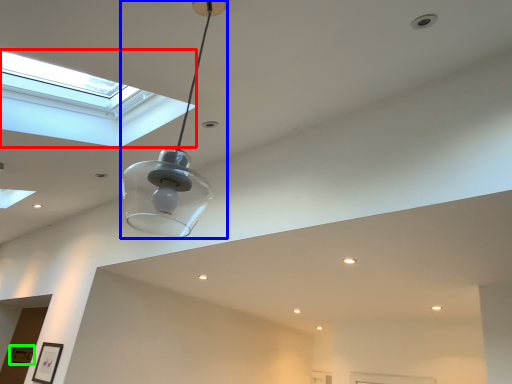
Question: Which is nearer to the window (highlighted by a red box)? lamp (highlighted by a blue box) or picture frame (highlighted by a green box).

Choices:
 (A) lamp
 (B) picture frame

Answer: (A)